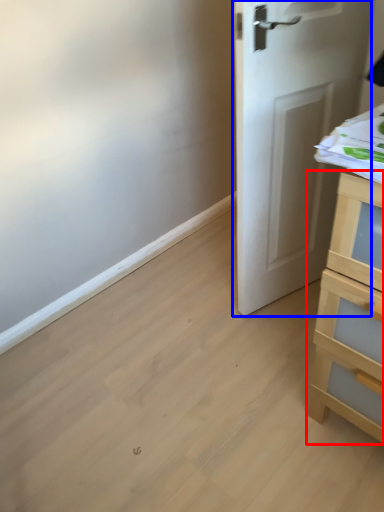
Question: Which object is closer to the camera taking this photo, chest of drawers (highlighted by a red box) or door (highlighted by a blue box)?

Choices:
 (A) chest of drawers
 (B) door

Answer: (A)